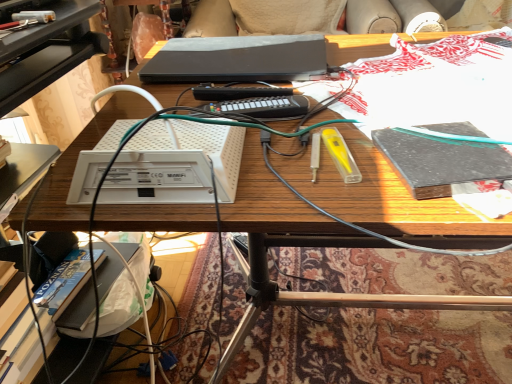
The image size is (512, 384). What are the coordinates of `free area behind black matte book at right` in the screenshot? It's located at (399, 110).